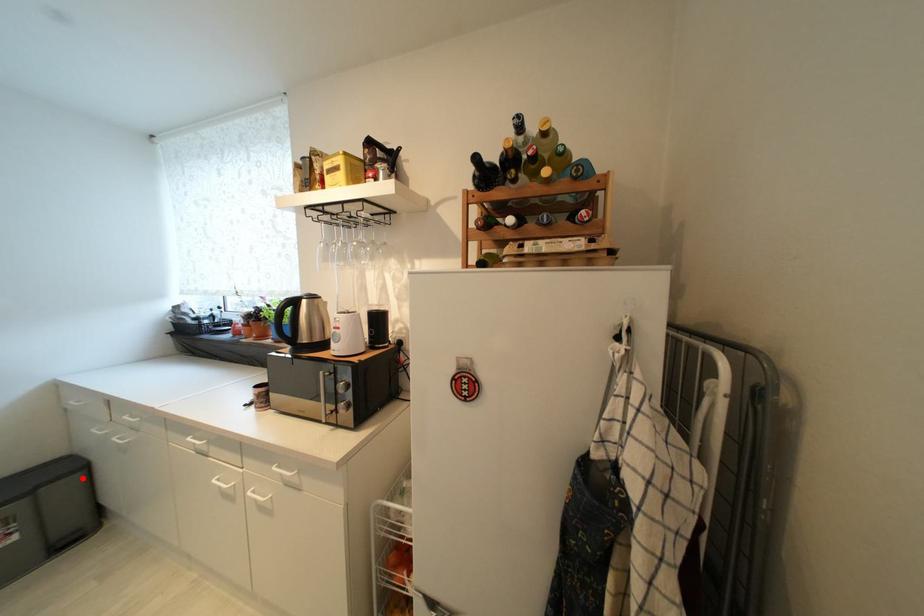
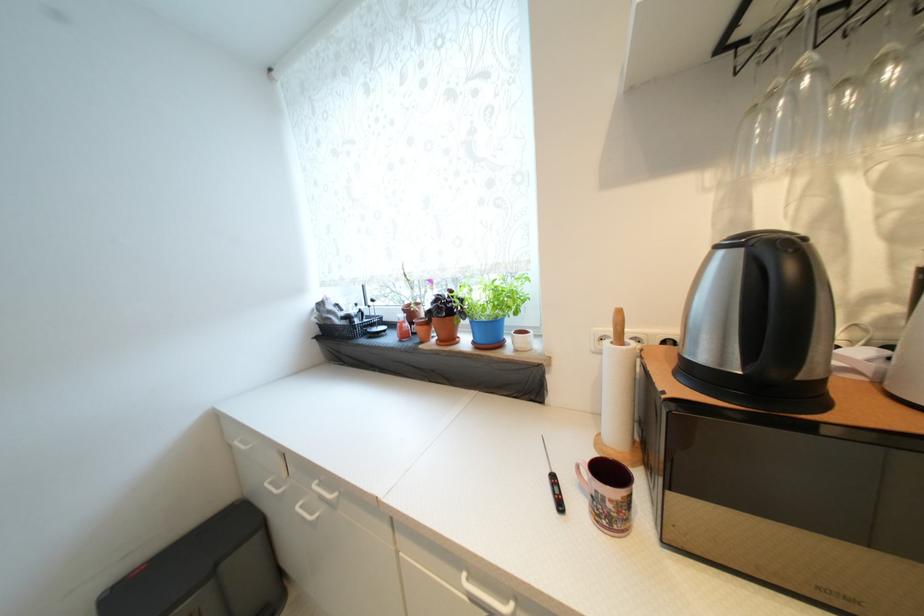
The point at the highlighted location is marked in the first image. Where is the corresponding point in the second image?

(261, 541)